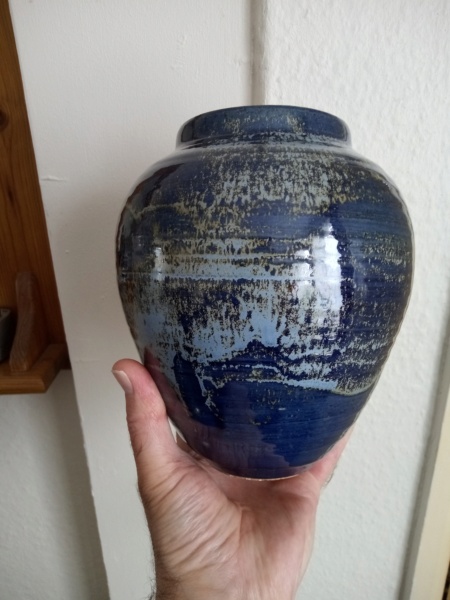
Locate an element on the screen. Image resolution: width=450 pixels, height=600 pixels. white wall is located at coordinates (333, 532).